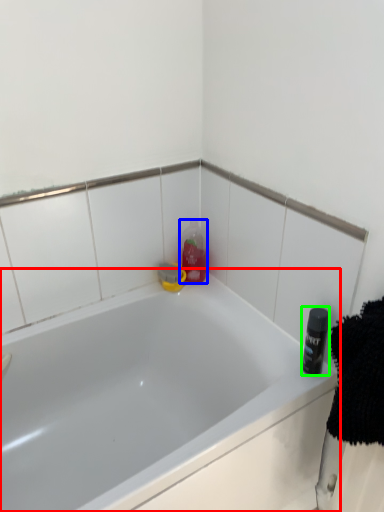
Question: Based on their relative distances, which object is farther from bathtub (highlighted by a red box)? Choose from cleaning product (highlighted by a blue box) and toiletry (highlighted by a green box).

Choices:
 (A) cleaning product
 (B) toiletry

Answer: (B)